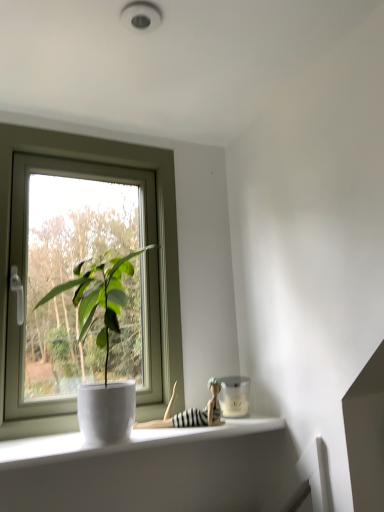
Find the location of a particular element. Image resolution: width=384 pixels, height=512 pixels. vacant space to the right of striped fabric doll at lower center is located at coordinates (231, 423).